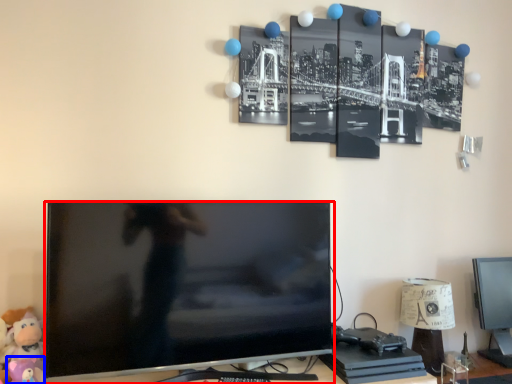
Question: Which object appears farthest to the camera in this image, television (highlighted by a red box) or toy (highlighted by a blue box)?

Choices:
 (A) television
 (B) toy

Answer: (B)